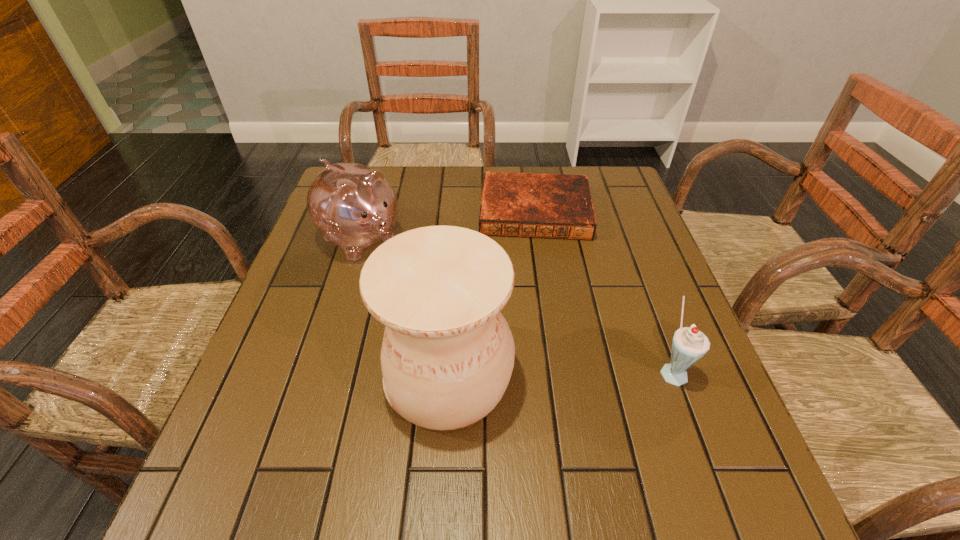
Find the location of `the tallest object`. the tallest object is located at coordinates (447, 356).

At what (x,y) coordinates should I click in order to perform the action: click on the rightmost object. Please return your answer as a coordinate pair (x, y). Looking at the image, I should click on (689, 344).

Locate an element on the screen. Image resolution: width=960 pixels, height=540 pixels. milkshake is located at coordinates (689, 344).

Locate an element on the screen. The width and height of the screenshot is (960, 540). Bible is located at coordinates (555, 206).

You are a GUI agent. You are given a task and a screenshot of the screen. Output one action in this format:
    pyautogui.click(x=<x>, y=<y>)
    Task: Click on the piggy bank
    The image size is (960, 540).
    Given the screenshot: What is the action you would take?
    pyautogui.click(x=353, y=206)

What are the coordinates of `the leftmost object` in the screenshot? It's located at (353, 206).

Find the location of a particular element. The height and width of the screenshot is (540, 960). free space located at the open side of the pottery is located at coordinates (256, 375).

This screenshot has width=960, height=540. Identify the location of blank space located 0.220m at the open side of the pottery. (272, 375).

Find the location of a particular element. free space located 0.110m at the open side of the pottery is located at coordinates (328, 375).

The width and height of the screenshot is (960, 540). I want to click on vacant space located on the spine side of the Bible, so click(537, 309).